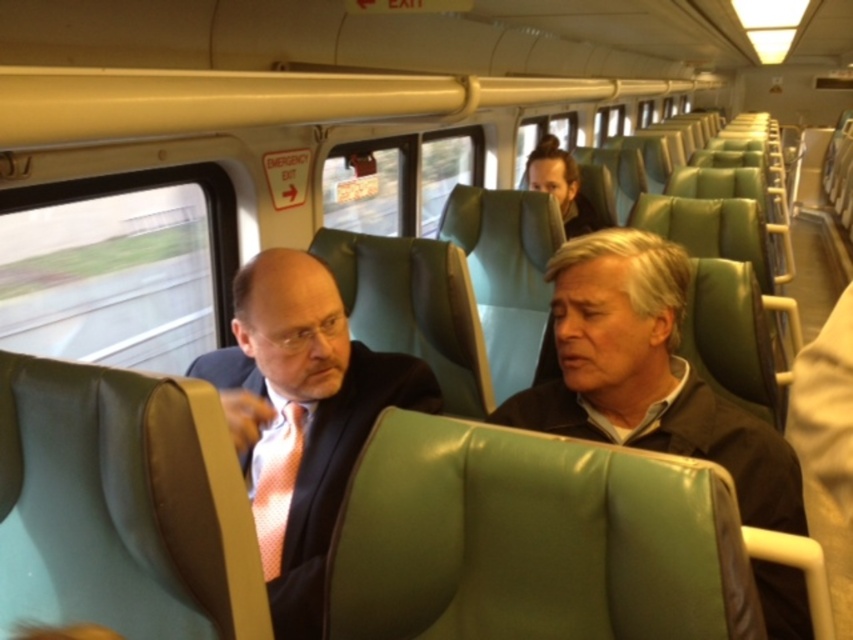
Question: Which point appears closest to the camera in this image?

Choices:
 (A) (532, 156)
 (B) (294, 438)
 (C) (566, 365)
 (D) (396, 365)

Answer: (C)

Question: Which point is farther to the camera?

Choices:
 (A) matte black suit at center
 (B) matte brown jacket at center
 (C) dark brown leather jacket at upper center
 (D) pink dotted tie at center

Answer: (C)

Question: Does matte brown jacket at center appear on the left side of pink dotted tie at center?

Choices:
 (A) no
 (B) yes

Answer: (A)

Question: Which object is the closest to the matte brown jacket at center?

Choices:
 (A) matte black suit at center
 (B) dark brown leather jacket at upper center
 (C) pink dotted tie at center

Answer: (A)

Question: Does matte brown jacket at center have a smaller size compared to matte black suit at center?

Choices:
 (A) no
 (B) yes

Answer: (B)

Question: Can you confirm if matte brown jacket at center is positioned below pink dotted tie at center?

Choices:
 (A) yes
 (B) no

Answer: (B)